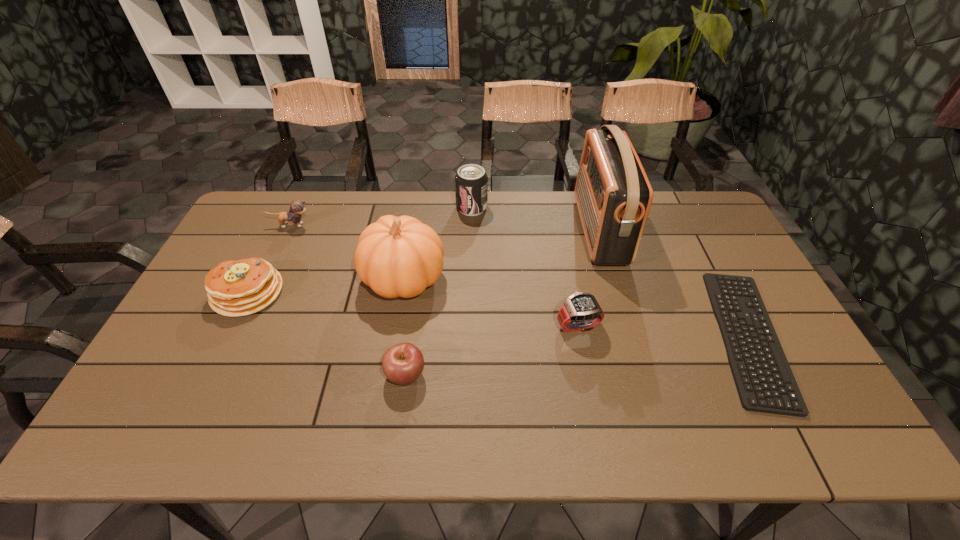
Where is `free space between the watch and the second tallest object`? The height and width of the screenshot is (540, 960). free space between the watch and the second tallest object is located at coordinates (491, 302).

What are the coordinates of `empty space that is in between the pancake and the rightmost object` in the screenshot? It's located at (498, 315).

Identify the location of empty space between the seventh tallest object and the tallest object. (503, 302).

The image size is (960, 540). In order to click on blank region between the sixth object from left to right and the pancake in this screenshot , I will do `click(413, 309)`.

Find the location of a particular element. empty space between the apple and the rightmost object is located at coordinates (577, 355).

Find the location of `object that is the sixth closest one to the watch`. object that is the sixth closest one to the watch is located at coordinates (234, 288).

Find the location of `the closest object to the shortest object`. the closest object to the shortest object is located at coordinates (613, 194).

Locate an element on the screen. This screenshot has width=960, height=540. vacant space that satisfies the following two spatial constraints: 1. on the front-facing side of the kitten; 2. on the left side of the shortest object is located at coordinates (239, 337).

This screenshot has height=540, width=960. I want to click on free space that satisfies the following two spatial constraints: 1. on the back side of the computer keyboard; 2. on the front-facing side of the tallest object, so pyautogui.click(x=692, y=230).